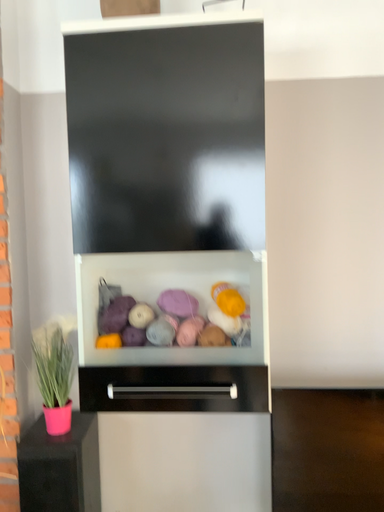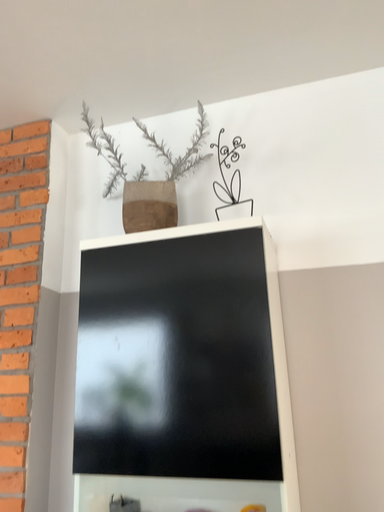
Question: Which way did the camera rotate in the video?

Choices:
 (A) rotated downward
 (B) rotated upward

Answer: (B)